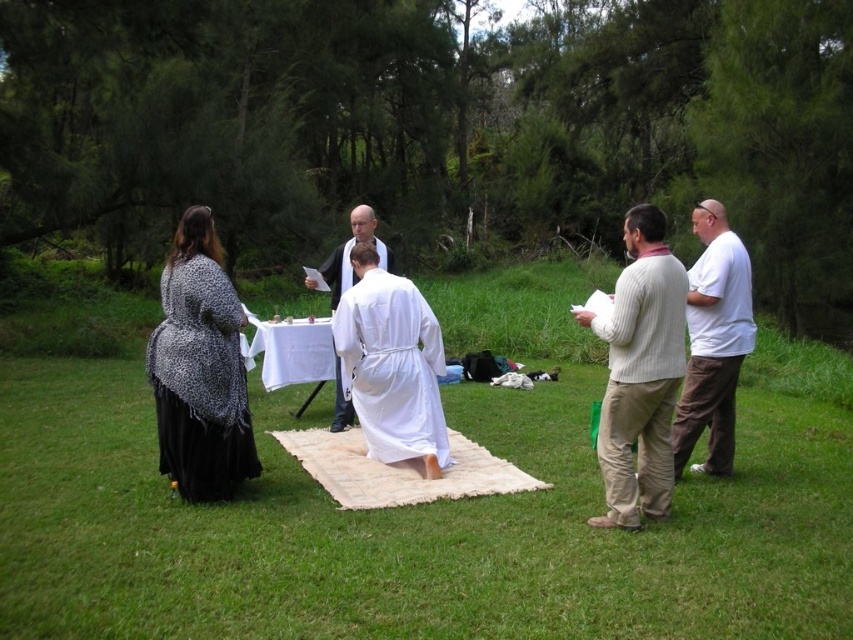
Question: Observing the image, what is the correct spatial positioning of green grass at center in reference to white sweater at right?

Choices:
 (A) left
 (B) right

Answer: (A)

Question: Can you confirm if green grass at center is positioned to the left of leopard print fabric at left?

Choices:
 (A) no
 (B) yes

Answer: (A)

Question: Where is leopard print fabric at left located in relation to white cotton shirt at right in the image?

Choices:
 (A) above
 (B) below

Answer: (B)

Question: Which object is positioned farthest from the white silk robe at center?

Choices:
 (A) green grass at center
 (B) white cotton shirt at right
 (C) leopard print fabric at left
 (D) white clothed figure at center

Answer: (B)

Question: Estimate the real-world distances between objects in this image. Which object is farther from the white clothed figure at center?

Choices:
 (A) white cotton shirt at right
 (B) white silk robe at center

Answer: (A)

Question: Among these points, which one is nearest to the camera?

Choices:
 (A) (624, 349)
 (B) (363, 225)
 (C) (289, 584)
 (D) (167, 417)

Answer: (C)